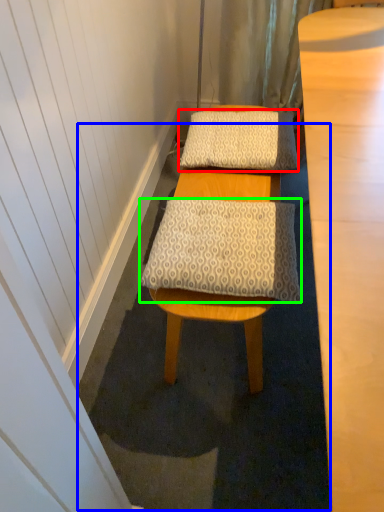
Question: Estimate the real-world distances between objects in this image. Which object is farther from pillow (highlighted by a red box), bath mat (highlighted by a blue box) or pillow (highlighted by a green box)?

Choices:
 (A) bath mat
 (B) pillow

Answer: (A)